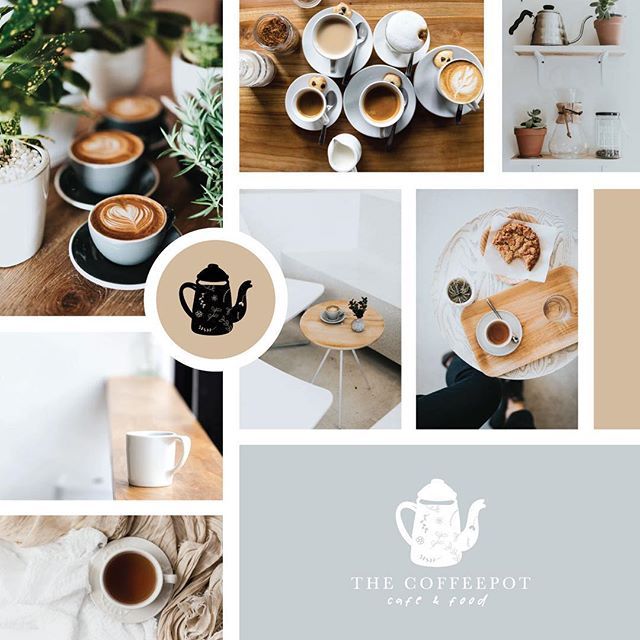
This screenshot has height=640, width=640. What are the coordinates of `jars` in the screenshot? It's located at (568, 129), (610, 131), (250, 65), (276, 34).